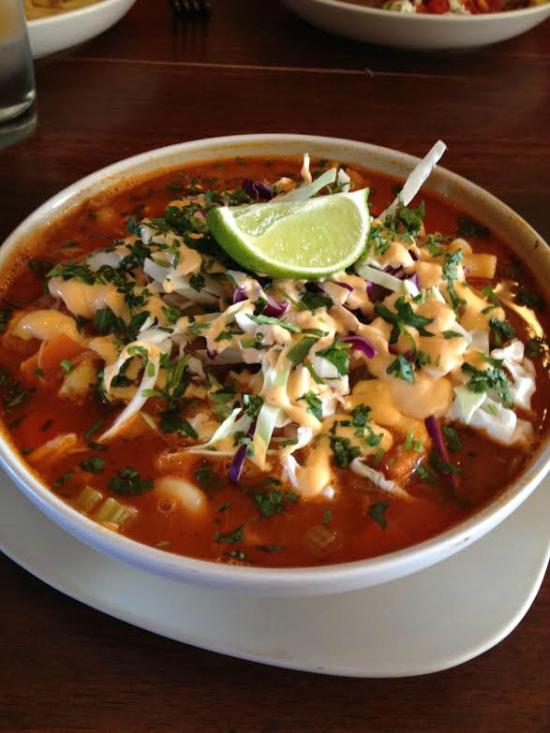
Find the location of a particular element. The width and height of the screenshot is (550, 733). table is located at coordinates (82, 670).